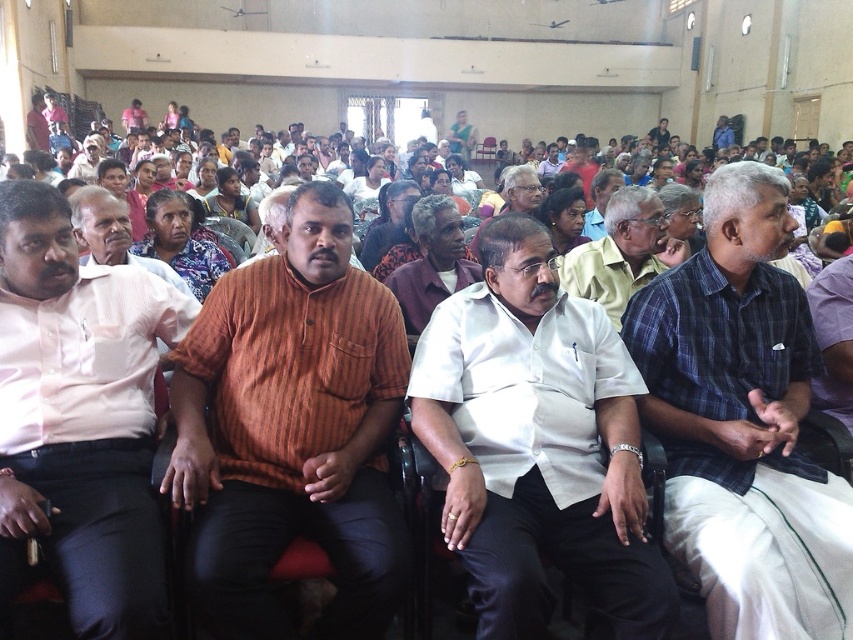
Question: Which of the following is the farthest from the observer?

Choices:
 (A) maroon shirt at center
 (B) matte orange shirt at center
 (C) pink cotton shirt at left
 (D) orange striped shirt at center

Answer: (B)

Question: Does floral fabric saree at center appear on the right side of matte orange shirt at center?

Choices:
 (A) yes
 (B) no

Answer: (A)

Question: Estimate the real-world distances between objects in this image. Which object is farther from the maroon shirt at center?

Choices:
 (A) dark brown striped shirt at center
 (B) white shirt at center
 (C) pink cotton shirt at left
 (D) matte orange shirt at center

Answer: (D)

Question: Does orange striped shirt at center come in front of dark brown striped shirt at center?

Choices:
 (A) no
 (B) yes

Answer: (B)

Question: From the image, what is the correct spatial relationship of orange striped shirt at center in relation to blue plaid shirt at center?

Choices:
 (A) right
 (B) left

Answer: (B)

Question: Which point is closer to the camera?

Choices:
 (A) (408, 320)
 (B) (236, 192)

Answer: (A)